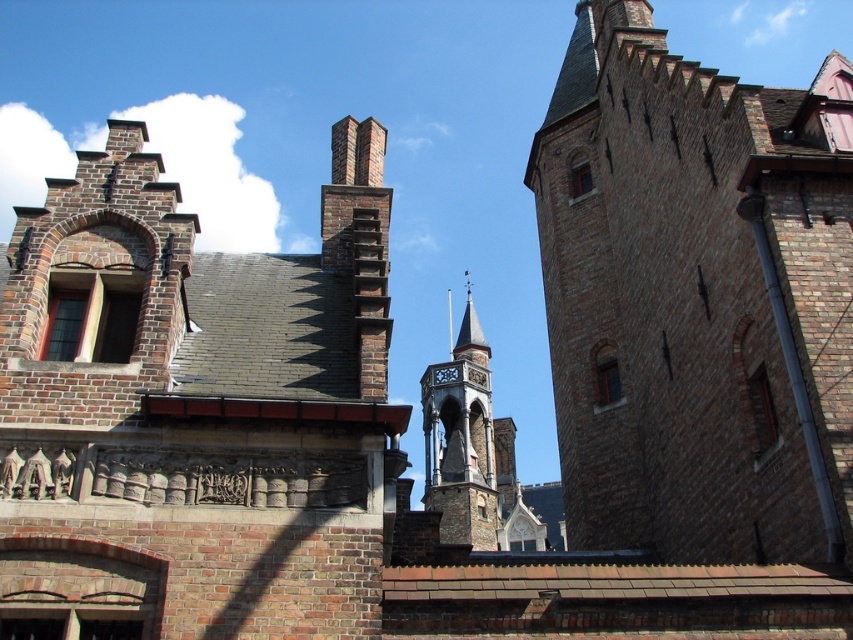
Question: Is brown brick tower at right positioned behind smooth gray stone spire at center?

Choices:
 (A) no
 (B) yes

Answer: (A)

Question: Can you confirm if brick chimney at upper center is bigger than smooth gray stone spire at center?

Choices:
 (A) yes
 (B) no

Answer: (B)

Question: Which point appears closest to the camera in this image?

Choices:
 (A) (598, 58)
 (B) (465, 368)
 (C) (479, 355)

Answer: (A)

Question: Which point appears closest to the camera in this image?

Choices:
 (A) (811, 333)
 (B) (199, 305)

Answer: (A)

Question: Which point appears closest to the camera in this image?

Choices:
 (A) (467, 342)
 (B) (367, 561)
 (C) (578, 355)

Answer: (B)

Question: Is brown brick tower at right further to camera compared to smooth gray stone spire at center?

Choices:
 (A) no
 (B) yes

Answer: (A)